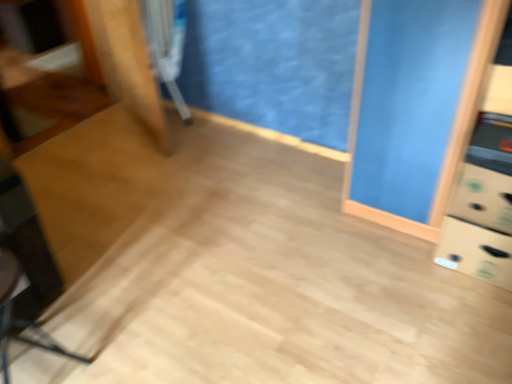
In order to face black plastic swivel chair at lower left, which appears as the 2th swivel chair when viewed from the back, should I rotate leftwards or rightwards?

Turn left by 29.913 degrees to look at black plastic swivel chair at lower left, which appears as the 2th swivel chair when viewed from the back.

What do you see at coordinates (20, 319) in the screenshot? This screenshot has width=512, height=384. I see `black plastic swivel chair at lower left, the 1th swivel chair in the bottom-to-top sequence` at bounding box center [20, 319].

The image size is (512, 384). What are the coordinates of `black plastic swivel chair at lower left, which is counted as the 2th swivel chair, starting from the top` in the screenshot? It's located at click(20, 319).

Find the location of a particular element. This screenshot has height=384, width=512. metallic silver swivel chair at upper left, the 2th swivel chair ordered from the bottom is located at coordinates (167, 45).

This screenshot has width=512, height=384. Describe the element at coordinates (167, 45) in the screenshot. I see `metallic silver swivel chair at upper left, arranged as the 1th swivel chair when viewed from the back` at that location.

You are a GUI agent. You are given a task and a screenshot of the screen. Output one action in this format:
    pyautogui.click(x=<x>, y=<y>)
    Task: Click on the black plastic swivel chair at lower left, the 1th swivel chair in the bottom-to-top sequence
    
    Given the screenshot: What is the action you would take?
    pyautogui.click(x=20, y=319)

Which is more to the right, metallic silver swivel chair at upper left, acting as the 2th swivel chair starting from the front, or black plastic swivel chair at lower left, marked as the 1th swivel chair in a front-to-back arrangement?

From the viewer's perspective, metallic silver swivel chair at upper left, acting as the 2th swivel chair starting from the front, appears more on the right side.

Is metallic silver swivel chair at upper left, which appears as the 1th swivel chair when viewed from the top, further to camera compared to black plastic swivel chair at lower left, which is counted as the 2th swivel chair, starting from the top?

Yes, metallic silver swivel chair at upper left, which appears as the 1th swivel chair when viewed from the top, is further from the viewer.

Between point (180, 46) and point (3, 303), which one is positioned in front?

Positioned in front is point (3, 303).

From the image's perspective, is metallic silver swivel chair at upper left, acting as the 2th swivel chair starting from the front, on top of black plastic swivel chair at lower left, marked as the 1th swivel chair in a front-to-back arrangement?

Yes, from the image's perspective, metallic silver swivel chair at upper left, acting as the 2th swivel chair starting from the front, is above black plastic swivel chair at lower left, marked as the 1th swivel chair in a front-to-back arrangement.

From a real-world perspective, is metallic silver swivel chair at upper left, which appears as the 1th swivel chair when viewed from the top, above or below black plastic swivel chair at lower left, which appears as the 2th swivel chair when viewed from the back?

metallic silver swivel chair at upper left, which appears as the 1th swivel chair when viewed from the top, is above black plastic swivel chair at lower left, which appears as the 2th swivel chair when viewed from the back.

Does metallic silver swivel chair at upper left, arranged as the 1th swivel chair when viewed from the back, have a greater width compared to black plastic swivel chair at lower left, which is counted as the 2th swivel chair, starting from the top?

No.

Is metallic silver swivel chair at upper left, acting as the 2th swivel chair starting from the front, shorter than black plastic swivel chair at lower left, which appears as the 2th swivel chair when viewed from the back?

In fact, metallic silver swivel chair at upper left, acting as the 2th swivel chair starting from the front, may be taller than black plastic swivel chair at lower left, which appears as the 2th swivel chair when viewed from the back.

Considering the sizes of metallic silver swivel chair at upper left, acting as the 2th swivel chair starting from the front, and black plastic swivel chair at lower left, which appears as the 2th swivel chair when viewed from the back, in the image, is metallic silver swivel chair at upper left, acting as the 2th swivel chair starting from the front, bigger or smaller than black plastic swivel chair at lower left, which appears as the 2th swivel chair when viewed from the back,?

metallic silver swivel chair at upper left, acting as the 2th swivel chair starting from the front, is bigger than black plastic swivel chair at lower left, which appears as the 2th swivel chair when viewed from the back.

Is metallic silver swivel chair at upper left, which appears as the 1th swivel chair when viewed from the top, not within black plastic swivel chair at lower left, which appears as the 2th swivel chair when viewed from the back?

Yes, metallic silver swivel chair at upper left, which appears as the 1th swivel chair when viewed from the top, is outside of black plastic swivel chair at lower left, which appears as the 2th swivel chair when viewed from the back.

Is metallic silver swivel chair at upper left, arranged as the 1th swivel chair when viewed from the back, not near black plastic swivel chair at lower left, which appears as the 2th swivel chair when viewed from the back?

That's right, there is a large distance between metallic silver swivel chair at upper left, arranged as the 1th swivel chair when viewed from the back, and black plastic swivel chair at lower left, which appears as the 2th swivel chair when viewed from the back.

Does metallic silver swivel chair at upper left, arranged as the 1th swivel chair when viewed from the back, turn towards black plastic swivel chair at lower left, which is counted as the 2th swivel chair, starting from the top?

No, metallic silver swivel chair at upper left, arranged as the 1th swivel chair when viewed from the back, is not turned towards black plastic swivel chair at lower left, which is counted as the 2th swivel chair, starting from the top.

Can you tell me how much metallic silver swivel chair at upper left, which appears as the 1th swivel chair when viewed from the top, and black plastic swivel chair at lower left, marked as the 1th swivel chair in a front-to-back arrangement, differ in facing direction?

The angular difference between metallic silver swivel chair at upper left, which appears as the 1th swivel chair when viewed from the top, and black plastic swivel chair at lower left, marked as the 1th swivel chair in a front-to-back arrangement, is 92.9 degrees.

Could you measure the distance between metallic silver swivel chair at upper left, arranged as the 1th swivel chair when viewed from the back, and black plastic swivel chair at lower left, which appears as the 2th swivel chair when viewed from the back?

A distance of 5.06 feet exists between metallic silver swivel chair at upper left, arranged as the 1th swivel chair when viewed from the back, and black plastic swivel chair at lower left, which appears as the 2th swivel chair when viewed from the back.

Image resolution: width=512 pixels, height=384 pixels. I want to click on swivel chair on the right of black plastic swivel chair at lower left, marked as the 1th swivel chair in a front-to-back arrangement, so click(x=167, y=45).

In the image, is black plastic swivel chair at lower left, the 1th swivel chair in the bottom-to-top sequence, on the left side or the right side of metallic silver swivel chair at upper left, which appears as the 1th swivel chair when viewed from the top?

black plastic swivel chair at lower left, the 1th swivel chair in the bottom-to-top sequence, is positioned on metallic silver swivel chair at upper left, which appears as the 1th swivel chair when viewed from the top,'s left side.

Considering the positions of objects black plastic swivel chair at lower left, which appears as the 2th swivel chair when viewed from the back, and metallic silver swivel chair at upper left, the 2th swivel chair ordered from the bottom, in the image provided, who is in front, black plastic swivel chair at lower left, which appears as the 2th swivel chair when viewed from the back, or metallic silver swivel chair at upper left, the 2th swivel chair ordered from the bottom,?

Positioned in front is black plastic swivel chair at lower left, which appears as the 2th swivel chair when viewed from the back.

Is point (10, 321) closer or farther from the camera than point (159, 53)?

Clearly, point (10, 321) is closer to the camera than point (159, 53).

From the image's perspective, is black plastic swivel chair at lower left, marked as the 1th swivel chair in a front-to-back arrangement, located beneath metallic silver swivel chair at upper left, which appears as the 1th swivel chair when viewed from the top?

Correct, black plastic swivel chair at lower left, marked as the 1th swivel chair in a front-to-back arrangement, appears lower than metallic silver swivel chair at upper left, which appears as the 1th swivel chair when viewed from the top, in the image.

From a real-world perspective, which is physically below, black plastic swivel chair at lower left, the 1th swivel chair in the bottom-to-top sequence, or metallic silver swivel chair at upper left, which appears as the 1th swivel chair when viewed from the top?

black plastic swivel chair at lower left, the 1th swivel chair in the bottom-to-top sequence.

Considering the sizes of objects black plastic swivel chair at lower left, which appears as the 2th swivel chair when viewed from the back, and metallic silver swivel chair at upper left, acting as the 2th swivel chair starting from the front, in the image provided, who is thinner, black plastic swivel chair at lower left, which appears as the 2th swivel chair when viewed from the back, or metallic silver swivel chair at upper left, acting as the 2th swivel chair starting from the front,?

With smaller width is metallic silver swivel chair at upper left, acting as the 2th swivel chair starting from the front.

Does black plastic swivel chair at lower left, the 1th swivel chair in the bottom-to-top sequence, have a greater height compared to metallic silver swivel chair at upper left, arranged as the 1th swivel chair when viewed from the back?

No.

Who is smaller, black plastic swivel chair at lower left, the 1th swivel chair in the bottom-to-top sequence, or metallic silver swivel chair at upper left, the 2th swivel chair ordered from the bottom?

With smaller size is black plastic swivel chair at lower left, the 1th swivel chair in the bottom-to-top sequence.

Is black plastic swivel chair at lower left, the 1th swivel chair in the bottom-to-top sequence, positioned beyond the bounds of metallic silver swivel chair at upper left, arranged as the 1th swivel chair when viewed from the back?

black plastic swivel chair at lower left, the 1th swivel chair in the bottom-to-top sequence, is positioned outside metallic silver swivel chair at upper left, arranged as the 1th swivel chair when viewed from the back.

Is black plastic swivel chair at lower left, which is counted as the 2th swivel chair, starting from the top, far from metallic silver swivel chair at upper left, arranged as the 1th swivel chair when viewed from the back?

Yes, black plastic swivel chair at lower left, which is counted as the 2th swivel chair, starting from the top, and metallic silver swivel chair at upper left, arranged as the 1th swivel chair when viewed from the back, are quite far apart.

Is black plastic swivel chair at lower left, the 1th swivel chair in the bottom-to-top sequence, oriented towards metallic silver swivel chair at upper left, the 2th swivel chair ordered from the bottom?

No.

Locate an element on the screen. swivel chair below the metallic silver swivel chair at upper left, arranged as the 1th swivel chair when viewed from the back (from the image's perspective) is located at coordinates (20, 319).

Locate an element on the screen. swivel chair in front of the metallic silver swivel chair at upper left, acting as the 2th swivel chair starting from the front is located at coordinates (20, 319).

The height and width of the screenshot is (384, 512). In the image, there is a metallic silver swivel chair at upper left, arranged as the 1th swivel chair when viewed from the back. What are the coordinates of `swivel chair below it (from the image's perspective)` in the screenshot? It's located at (20, 319).